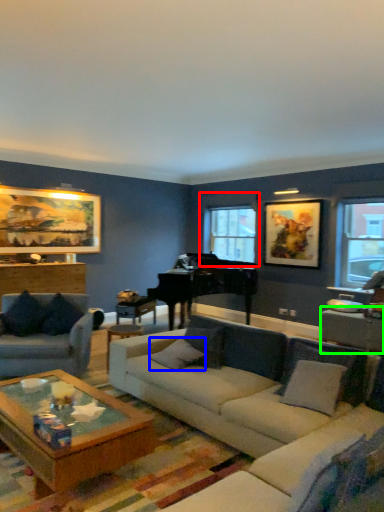
Question: Based on their relative distances, which object is nearer to window (highlighted by a red box)? Choose from pillow (highlighted by a blue box) and table (highlighted by a green box).

Choices:
 (A) pillow
 (B) table

Answer: (A)